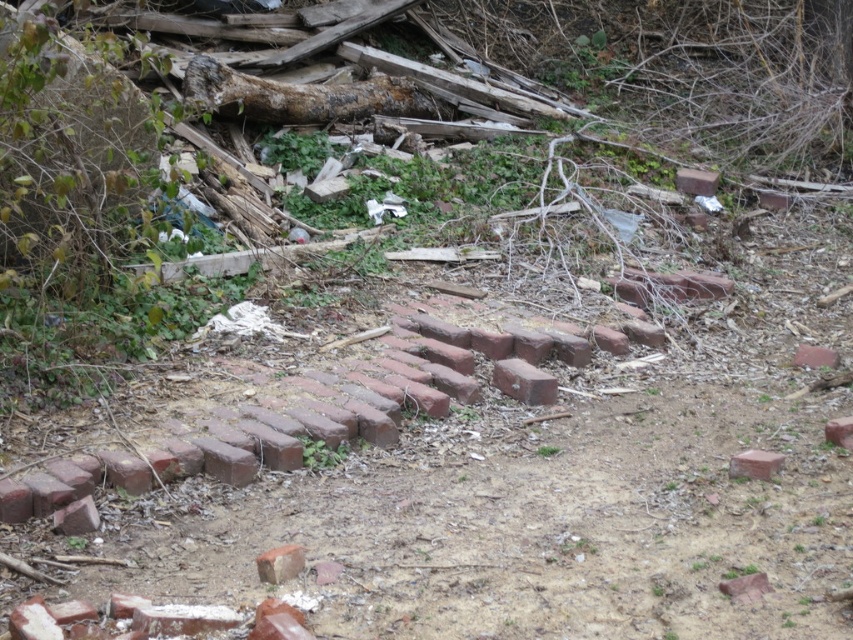
Question: Which of the following is the farthest from the observer?

Choices:
 (A) red brick at center
 (B) red matte brick at lower right

Answer: (B)

Question: Which point is farther from the camera taking this photo?

Choices:
 (A) (260, 566)
 (B) (851, 429)
 (C) (815, 358)
 (D) (711, 186)

Answer: (D)

Question: Which of these objects is positioned closest to the red matte brick at lower right?

Choices:
 (A) red clay brick at center
 (B) red clay brick at lower right
 (C) red brick at center
 (D) smooth red brick at center

Answer: (A)

Question: Is red brick at center closer to camera compared to red clay brick at lower right?

Choices:
 (A) no
 (B) yes

Answer: (B)

Question: Considering the relative positions of red clay brick at lower right and red clay brick at center in the image provided, where is red clay brick at lower right located with respect to red clay brick at center?

Choices:
 (A) left
 (B) right

Answer: (A)

Question: Is red clay brick at lower right positioned in front of red matte brick at lower right?

Choices:
 (A) yes
 (B) no

Answer: (A)